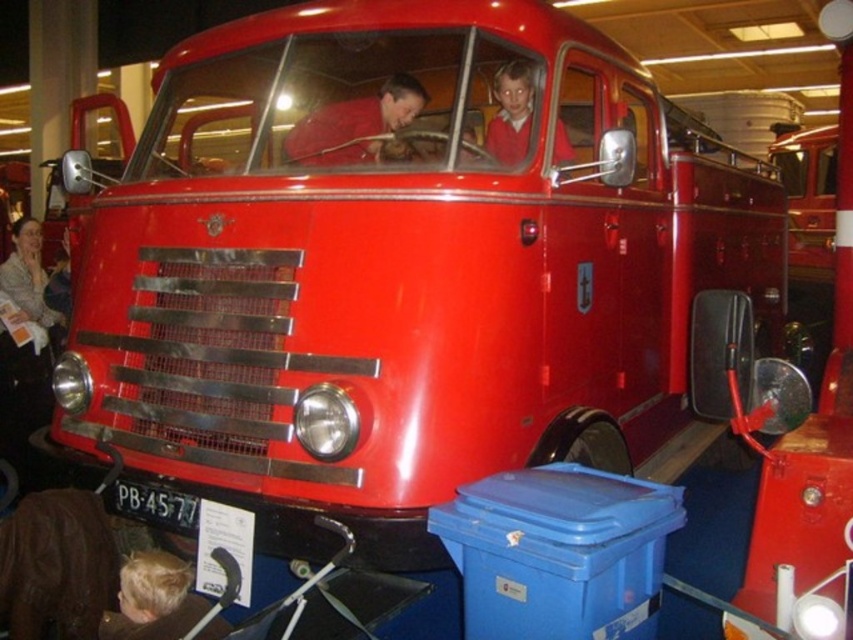
Which is more to the left, matte red shirt at center or smooth red shirt at upper center?

Positioned to the left is matte red shirt at center.

Is matte red shirt at center taller than smooth red shirt at upper center?

No.

Where is `matte red shirt at center`? matte red shirt at center is located at coordinates (355, 124).

Where is `matte red shirt at center`? The image size is (853, 640). matte red shirt at center is located at coordinates (355, 124).

Can you confirm if blonde hair at lower left is positioned to the right of matte red shirt at center?

In fact, blonde hair at lower left is to the left of matte red shirt at center.

Who is more forward, (123, 566) or (302, 157)?

Positioned in front is point (123, 566).

Where is `blonde hair at lower left`? This screenshot has height=640, width=853. blonde hair at lower left is located at coordinates [x=154, y=600].

Can you confirm if glossy red fire truck at center is positioned to the left of blonde hair at lower left?

Incorrect, glossy red fire truck at center is not on the left side of blonde hair at lower left.

Does point (799, 541) come behind point (131, 634)?

Yes, point (799, 541) is behind point (131, 634).

Between point (840, 275) and point (100, 634), which one is positioned in front?

Point (100, 634) is in front.

This screenshot has width=853, height=640. I want to click on glossy red fire truck at center, so click(814, 442).